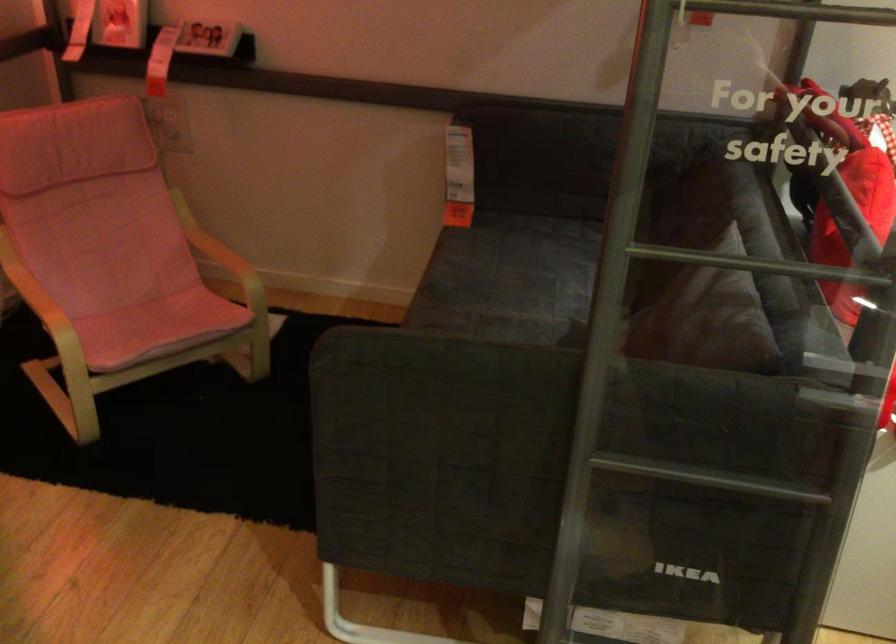
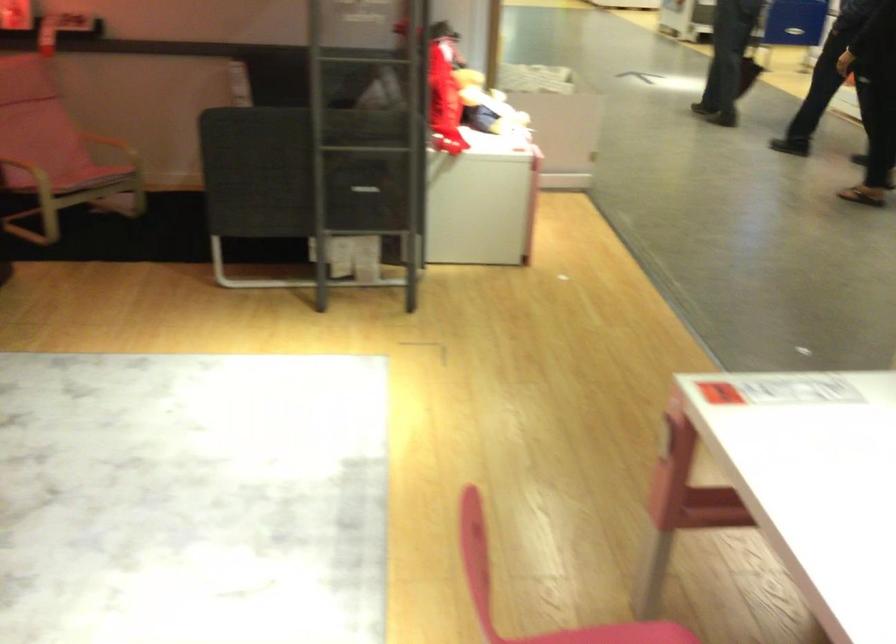
The point at (220, 252) is marked in the first image. Where is the corresponding point in the second image?

(117, 131)